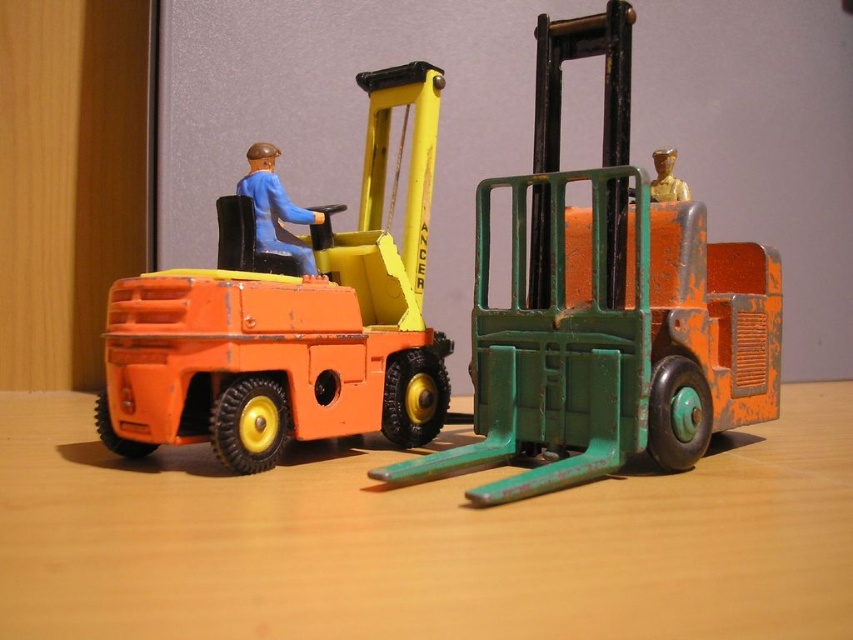
Question: Considering the real-world distances, which object is farthest from the green matte forklift at right?

Choices:
 (A) gold metallic figure at center
 (B) orange matte forklift at left

Answer: (B)

Question: Which point is farther from the camera taking this photo?

Choices:
 (A) (259, 198)
 (B) (380, 371)
 (C) (683, 186)
 (D) (604, 161)

Answer: (C)

Question: Is green matte forklift at right to the left of matte blue figure at center from the viewer's perspective?

Choices:
 (A) yes
 (B) no

Answer: (B)

Question: Is orange matte forklift at left above matte blue figure at center?

Choices:
 (A) yes
 (B) no

Answer: (B)

Question: Is green matte forklift at right smaller than orange matte forklift at left?

Choices:
 (A) yes
 (B) no

Answer: (B)

Question: Which of the following is the farthest from the observer?

Choices:
 (A) (372, 184)
 (B) (614, 132)

Answer: (A)